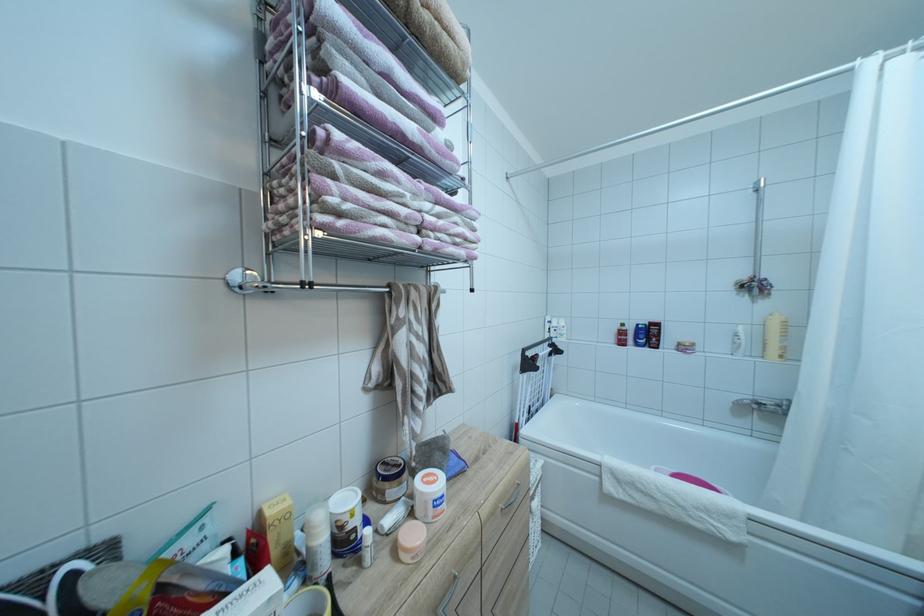
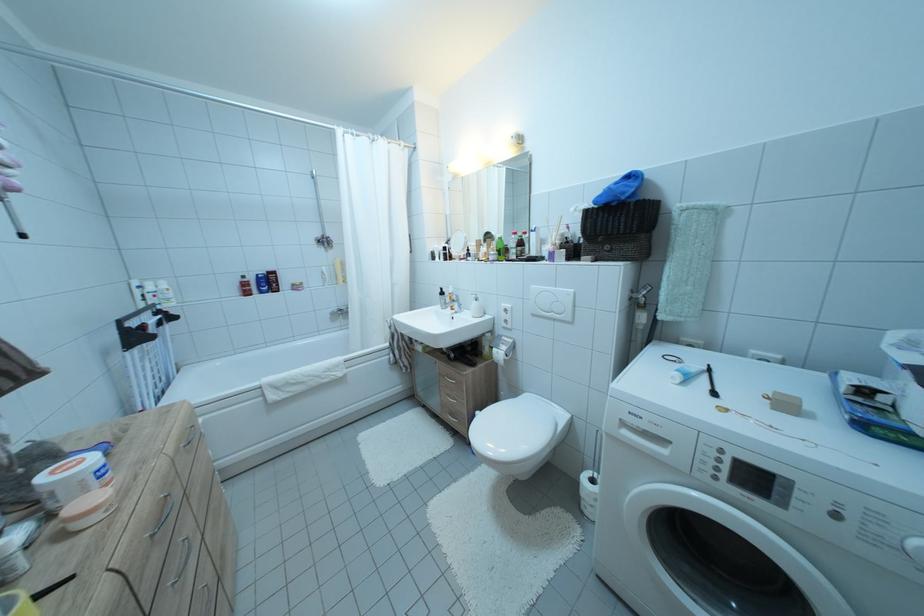
Question: The first image is from the beginning of the video and the second image is from the end. How did the camera likely rotate when shooting the video?

Choices:
 (A) Left
 (B) Right
 (C) Up
 (D) Down

Answer: (B)